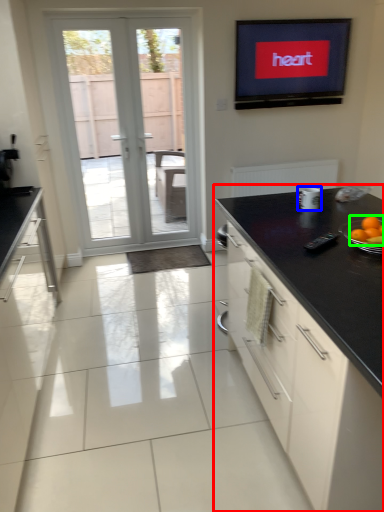
Question: Estimate the real-world distances between objects in this image. Which object is closer to cabinetry (highlighted by a red box), appliance (highlighted by a blue box) or orange (highlighted by a green box)?

Choices:
 (A) appliance
 (B) orange

Answer: (B)